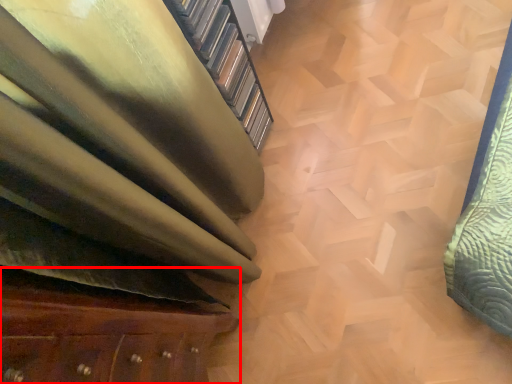
Question: Considering the relative positions of furniture (annotated by the red box) and stairwell in the image provided, where is furniture (annotated by the red box) located with respect to the staircase?

Choices:
 (A) right
 (B) left

Answer: (B)